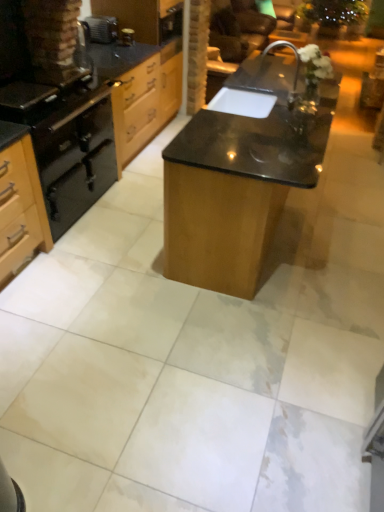
Question: Relative to matte black oven at left, is wooden drawer at upper left in front or behind?

Choices:
 (A) front
 (B) behind

Answer: (B)

Question: In terms of size, does wooden drawer at upper left appear bigger or smaller than matte black oven at left?

Choices:
 (A) big
 (B) small

Answer: (A)

Question: Considering the real-world distances, which object is closest to the metallic canister at upper center, positioned as the second appliance in left-to-right order?

Choices:
 (A) matte black oven at left
 (B) wooden drawer at upper left
 (C) brown leather armchair at upper center
 (D) black matte oven at left
 (E) brushed metal toaster at upper left, the 2th appliance in the right-to-left sequence

Answer: (E)

Question: Which object is positioned closest to the black matte gas stove at left?

Choices:
 (A) metallic canister at upper center, positioned as the second appliance in left-to-right order
 (B) black matte oven at left
 (C) wooden drawer at upper left
 (D) brushed metal toaster at upper left, the 2th appliance in the right-to-left sequence
 (E) matte black oven at left

Answer: (B)